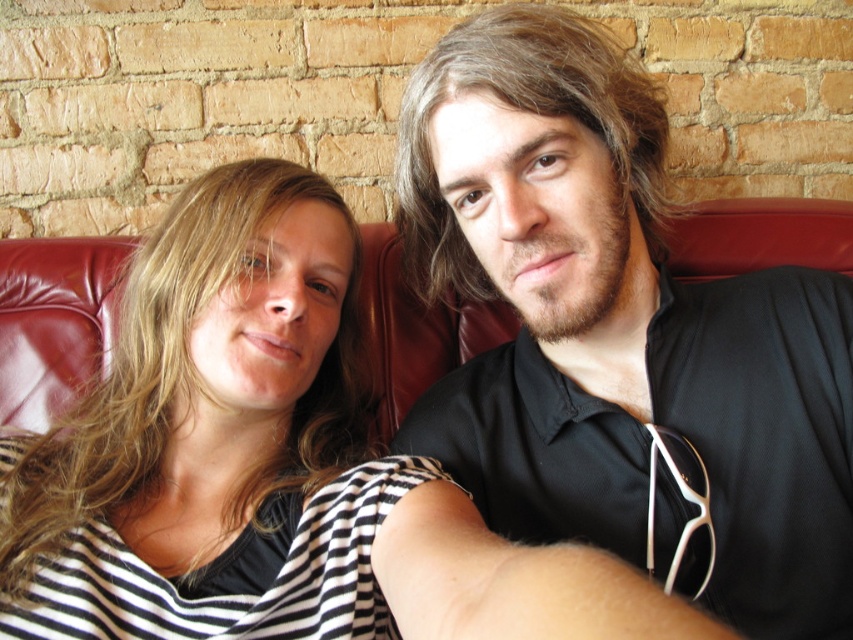
Between point (750, 561) and point (488, 602), which one is positioned in front?

Positioned in front is point (488, 602).

Which is in front, point (457, 458) or point (138, 515)?

Point (138, 515) is more forward.

Where is `black matte shirt at center`? Image resolution: width=853 pixels, height=640 pixels. black matte shirt at center is located at coordinates (618, 326).